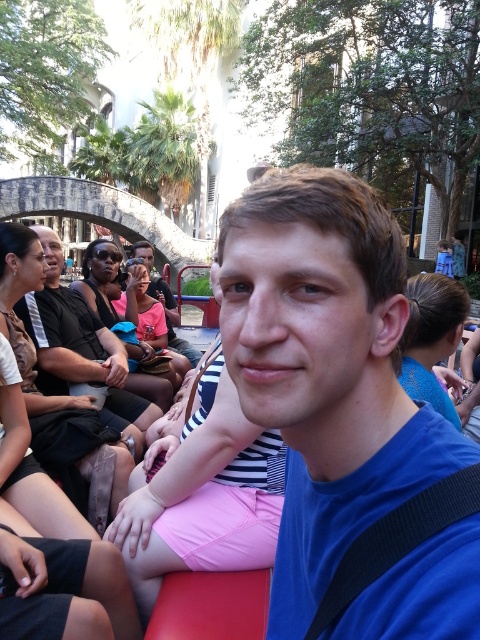
Question: Can you confirm if matte black shirt at center is positioned to the right of matte pink shirt at center?

Choices:
 (A) no
 (B) yes

Answer: (B)

Question: Which point appears closest to the camera in this image?

Choices:
 (A) (162, 305)
 (B) (343, 358)

Answer: (B)

Question: In this image, where is blue matte shirt at center located relative to matte black shirt at center?

Choices:
 (A) right
 (B) left

Answer: (A)

Question: Which of the following is the closest to the observer?

Choices:
 (A) (45, 348)
 (B) (369, 307)
 (C) (172, 296)

Answer: (B)

Question: Does matte black shirt at center appear on the left side of matte pink shirt at center?

Choices:
 (A) yes
 (B) no

Answer: (B)

Question: Which point is closer to the camera taking this photo?

Choices:
 (A) (113, 348)
 (B) (157, 282)
 (C) (362, 346)

Answer: (C)